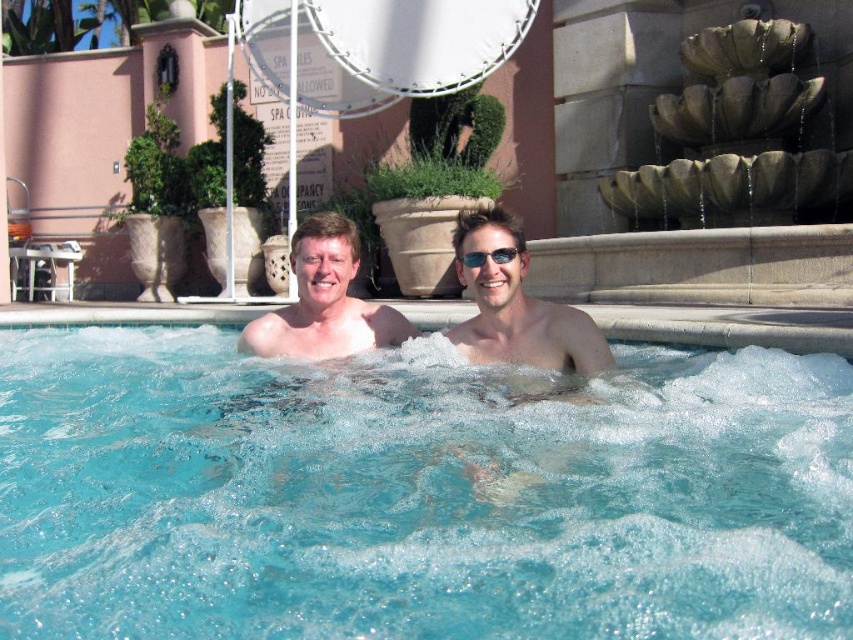
What do you see at coordinates (416, 493) in the screenshot? I see `clear blue water at center` at bounding box center [416, 493].

Is point (573, 442) closer to camera compared to point (483, 257)?

Yes, point (573, 442) is closer to viewer.

What are the coordinates of `clear blue water at center` in the screenshot? It's located at (416, 493).

Is smooth skin man at center below sunglasses at center?

Correct, smooth skin man at center is located below sunglasses at center.

Does smooth skin man at center appear on the right side of sunglasses at center?

No, smooth skin man at center is not to the right of sunglasses at center.

Which is behind, point (299, 310) or point (503, 253)?

The point (299, 310) is more distant.

Locate an element on the screen. smooth skin man at center is located at coordinates (323, 300).

Is matte skin at center positioned before sunglasses at center?

Yes, matte skin at center is in front of sunglasses at center.

Does matte skin at center appear over sunglasses at center?

No, matte skin at center is not above sunglasses at center.

Is point (512, 301) closer to viewer compared to point (495, 253)?

That is False.

Where is `matte skin at center`? Image resolution: width=853 pixels, height=640 pixels. matte skin at center is located at coordinates (515, 304).